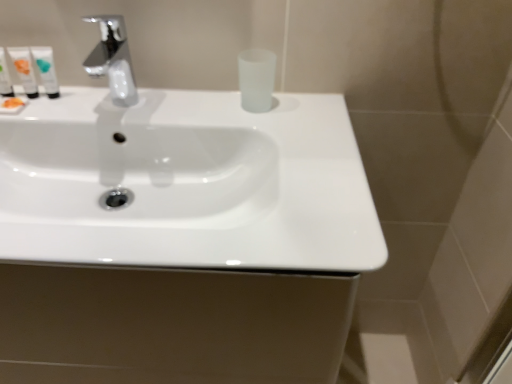
Question: From the image's perspective, is white glossy sink at center beneath chrome metallic faucet at upper left?

Choices:
 (A) no
 (B) yes

Answer: (B)

Question: Is white glossy sink at center to the right of chrome metallic faucet at upper left from the viewer's perspective?

Choices:
 (A) no
 (B) yes

Answer: (B)

Question: Is white glossy sink at center positioned beyond the bounds of chrome metallic faucet at upper left?

Choices:
 (A) yes
 (B) no

Answer: (A)

Question: Would you say white glossy sink at center contains chrome metallic faucet at upper left?

Choices:
 (A) yes
 (B) no

Answer: (B)

Question: Is white glossy sink at center behind chrome metallic faucet at upper left?

Choices:
 (A) yes
 (B) no

Answer: (B)

Question: From the image's perspective, is white glossy sink at center positioned above or below frosted glass cup at center, the fourth mouthwash viewed from the left?

Choices:
 (A) below
 (B) above

Answer: (A)

Question: In the image, is white glossy sink at center positioned in front of or behind frosted glass cup at center, marked as the first mouthwash in a right-to-left arrangement?

Choices:
 (A) behind
 (B) front

Answer: (B)

Question: From their relative heights in the image, would you say white glossy sink at center is taller or shorter than frosted glass cup at center, marked as the first mouthwash in a right-to-left arrangement?

Choices:
 (A) short
 (B) tall

Answer: (B)

Question: Looking at their shapes, would you say white glossy sink at center is wider or thinner than frosted glass cup at center, the fourth mouthwash viewed from the left?

Choices:
 (A) thin
 (B) wide

Answer: (B)

Question: Looking at the image, does translucent plastic tube at left, positioned as the first mouthwash in left-to-right order, seem bigger or smaller compared to frosted glass cup at center, marked as the first mouthwash in a right-to-left arrangement?

Choices:
 (A) big
 (B) small

Answer: (B)

Question: From a real-world perspective, is translucent plastic tube at left, marked as the fourth mouthwash in a right-to-left arrangement, above or below frosted glass cup at center, the fourth mouthwash viewed from the left?

Choices:
 (A) above
 (B) below

Answer: (A)

Question: Considering the positions of translucent plastic tube at left, marked as the fourth mouthwash in a right-to-left arrangement, and frosted glass cup at center, marked as the first mouthwash in a right-to-left arrangement, in the image, is translucent plastic tube at left, marked as the fourth mouthwash in a right-to-left arrangement, taller or shorter than frosted glass cup at center, marked as the first mouthwash in a right-to-left arrangement,?

Choices:
 (A) short
 (B) tall

Answer: (B)

Question: In the image, is translucent plastic tube at left, marked as the fourth mouthwash in a right-to-left arrangement, positioned in front of or behind frosted glass cup at center, marked as the first mouthwash in a right-to-left arrangement?

Choices:
 (A) behind
 (B) front

Answer: (A)

Question: Considering the relative positions of translucent plastic tube at left, positioned as the first mouthwash in left-to-right order, and white glossy tube at upper left, the 2th mouthwash positioned from the right, in the image provided, is translucent plastic tube at left, positioned as the first mouthwash in left-to-right order, to the left or to the right of white glossy tube at upper left, the 2th mouthwash positioned from the right,?

Choices:
 (A) right
 (B) left

Answer: (B)

Question: From a real-world perspective, is translucent plastic tube at left, positioned as the first mouthwash in left-to-right order, positioned above or below white glossy tube at upper left, the 2th mouthwash positioned from the right?

Choices:
 (A) below
 (B) above

Answer: (A)